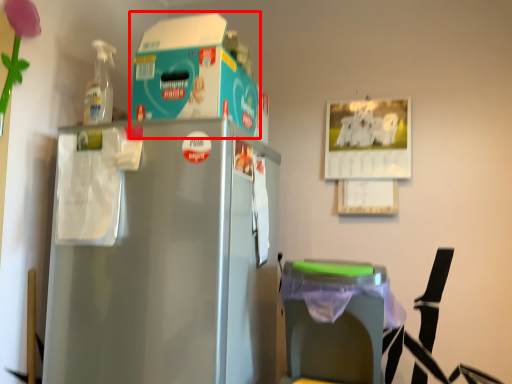
Question: From the image's perspective, where is storage box (annotated by the red box) located relative to table?

Choices:
 (A) above
 (B) below

Answer: (A)